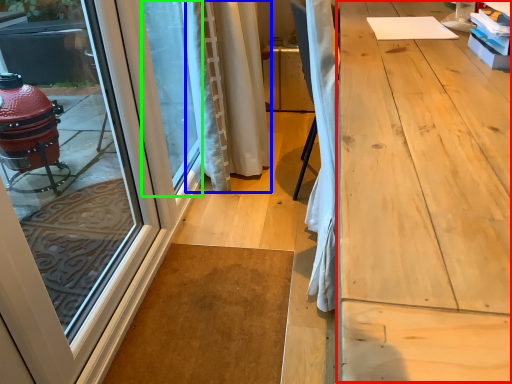
Question: Which is nearer to the workbench (highlighted by a red box)? curtain (highlighted by a blue box) or window screen (highlighted by a green box).

Choices:
 (A) curtain
 (B) window screen

Answer: (A)